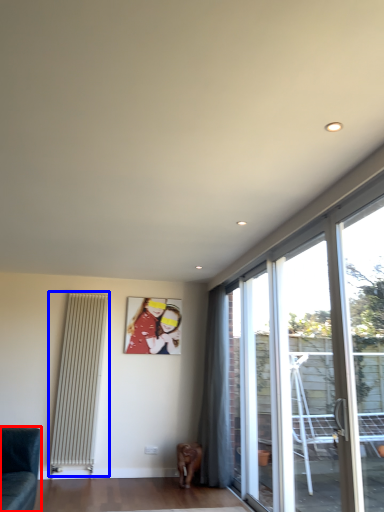
Question: Which object is closer to the camera taking this photo, studio couch (highlighted by a red box) or radiator (highlighted by a blue box)?

Choices:
 (A) studio couch
 (B) radiator

Answer: (A)